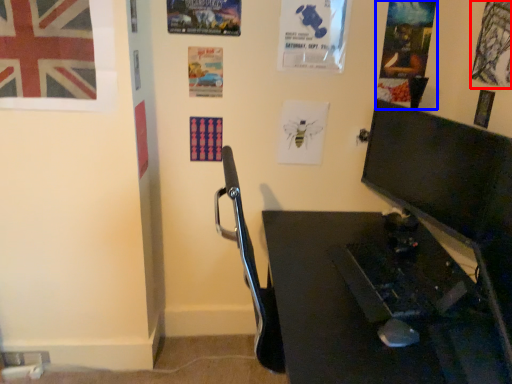
Question: Which point is further to the camera, poster page (highlighted by a red box) or poster page (highlighted by a blue box)?

Choices:
 (A) poster page
 (B) poster page

Answer: (B)